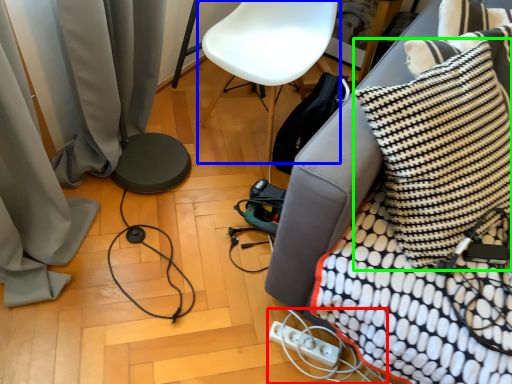
Question: Which object is positioned farthest from extension cord (highlighted by a red box)? Select from armchair (highlighted by a blue box) and pillow (highlighted by a green box).

Choices:
 (A) armchair
 (B) pillow

Answer: (A)